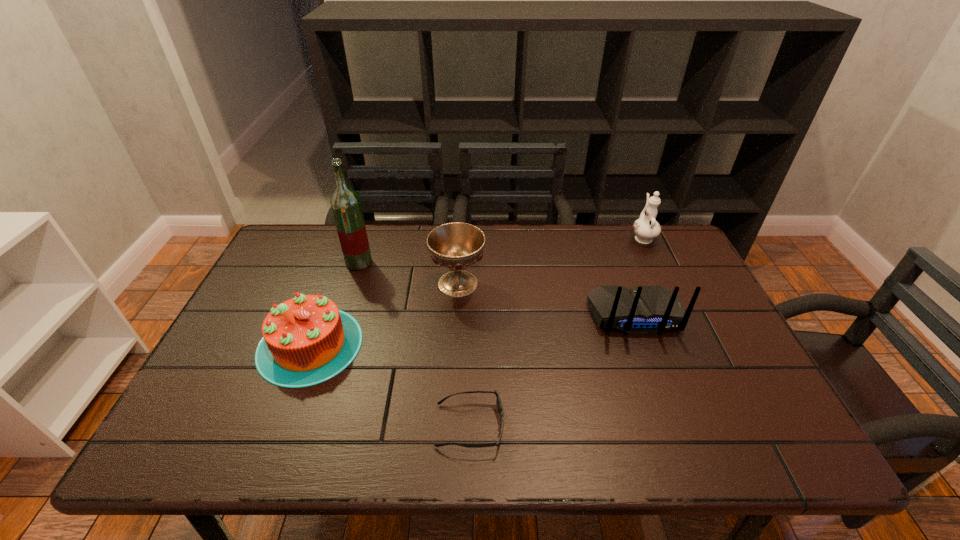
Where is `vacant space located 0.310m on the right of the cake`? This screenshot has height=540, width=960. vacant space located 0.310m on the right of the cake is located at coordinates (483, 345).

At what (x,y) coordinates should I click in order to perform the action: click on vacant space located on the front-facing side of the sunglasses. Please return your answer as a coordinate pair (x, y). The height and width of the screenshot is (540, 960). Looking at the image, I should click on (670, 426).

This screenshot has width=960, height=540. Identify the location of liquor located in the far edge section of the desktop. [345, 203].

The width and height of the screenshot is (960, 540). I want to click on chinaware that is positioned at the far edge, so click(x=646, y=228).

Locate an element on the screen. chalice that is at the far edge is located at coordinates (456, 246).

Find the location of a particular element. The image size is (960, 540). object situated at the near edge is located at coordinates tap(498, 401).

At what (x,y) coordinates should I click in order to perform the action: click on object present at the left edge. Please return your answer as a coordinate pair (x, y). Looking at the image, I should click on (307, 340).

This screenshot has height=540, width=960. What are the coordinates of `chinaware at the right edge` in the screenshot? It's located at (646, 228).

Where is `router that is at the right edge`? Image resolution: width=960 pixels, height=540 pixels. router that is at the right edge is located at coordinates 648,309.

Where is `object that is positioned at the far right corner`? The image size is (960, 540). object that is positioned at the far right corner is located at coordinates (646, 228).